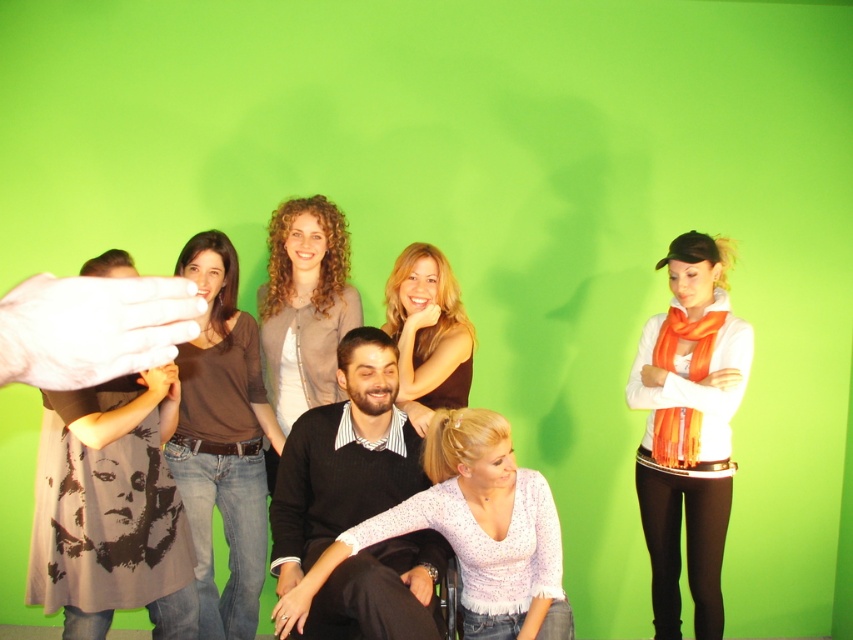
Does matte brown shirt at center have a lesser height compared to curly hair woman at center?

Incorrect, matte brown shirt at center's height does not fall short of curly hair woman at center's.

Is matte brown shirt at center further to camera compared to curly hair woman at center?

No, it is in front of curly hair woman at center.

Is point (219, 632) farther from camera compared to point (276, 314)?

No, (219, 632) is closer to viewer.

Where is `matte brown shirt at center`? The height and width of the screenshot is (640, 853). matte brown shirt at center is located at coordinates (222, 440).

How distant is orange scarf at center from matte brown shirt at center?

orange scarf at center is 4.57 feet from matte brown shirt at center.

Does orange scarf at center have a lesser width compared to matte brown shirt at center?

In fact, orange scarf at center might be wider than matte brown shirt at center.

Locate an element on the screen. This screenshot has width=853, height=640. orange scarf at center is located at coordinates (688, 429).

Between black sweater at center and matte brown blouse at center, which one has less height?

matte brown blouse at center

Is point (395, 460) behind point (432, 337)?

No, it is not.

Locate an element on the screen. This screenshot has width=853, height=640. black sweater at center is located at coordinates (343, 458).